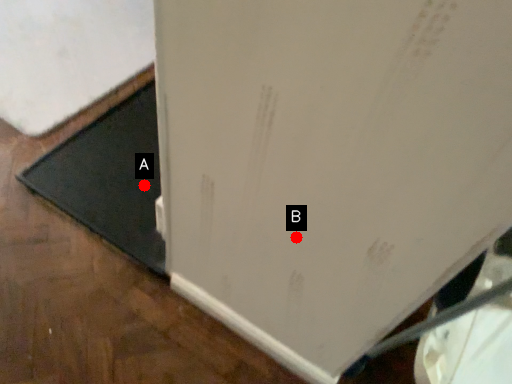
Question: Two points are circled on the image, labeled by A and B beside each circle. Which point is farther to the camera?

Choices:
 (A) A is further
 (B) B is further

Answer: (A)